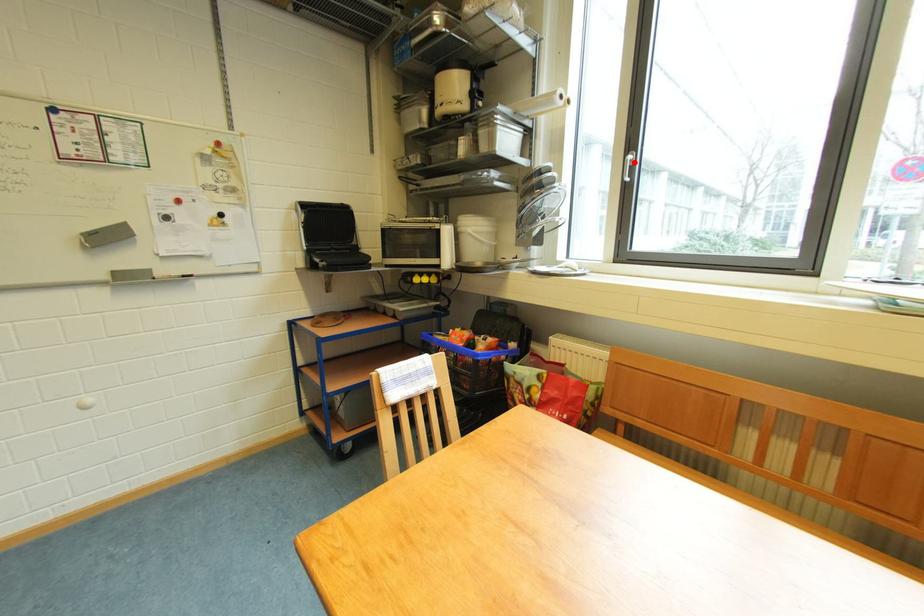
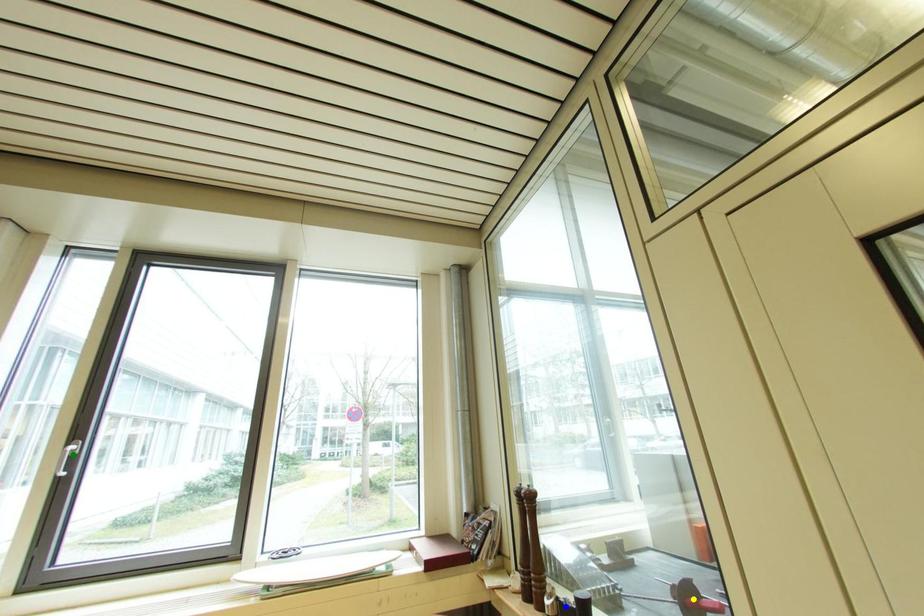
Question: I am providing you with two images of the same scene from different viewpoints. A red point is marked on the first image. You are given multiple points on the second image. Which spot in image 2 lines up with the point in image 1?

Choices:
 (A) green point
 (B) blue point
 (C) yellow point

Answer: (A)